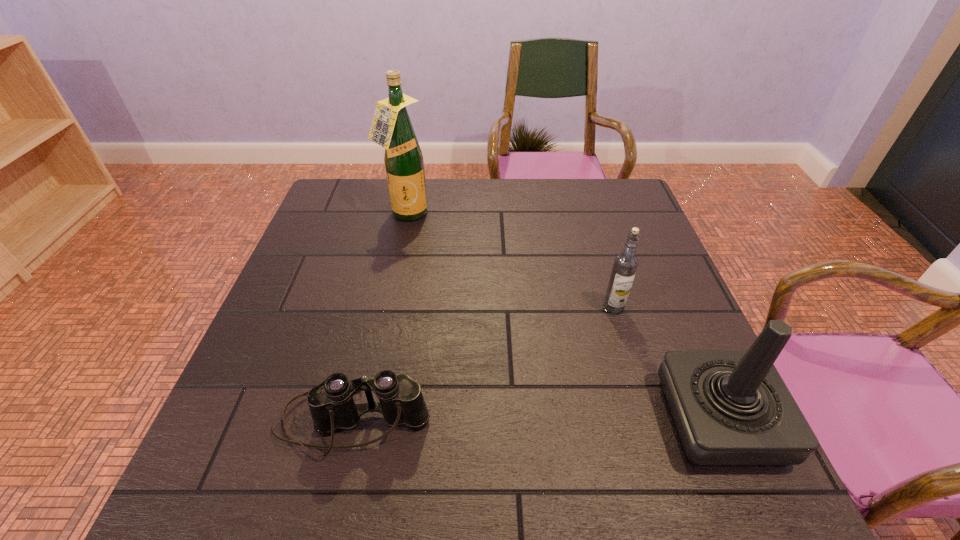
Image resolution: width=960 pixels, height=540 pixels. In order to click on vacant space located 0.340m on the label of the third nearest object in this screenshot , I will do `click(522, 413)`.

The width and height of the screenshot is (960, 540). I want to click on free space located on the label of the third nearest object, so click(593, 332).

This screenshot has height=540, width=960. What are the coordinates of `free space located 0.080m on the label of the third nearest object` in the screenshot? It's located at (590, 334).

The height and width of the screenshot is (540, 960). I want to click on object that is at the far edge, so click(391, 128).

Where is `binoculars situated at the near edge`? This screenshot has width=960, height=540. binoculars situated at the near edge is located at coordinates (331, 403).

Identify the location of joystick located in the near edge section of the desktop. (730, 408).

Find the location of a particular element. This screenshot has height=540, width=960. object present at the left edge is located at coordinates (331, 403).

You are a GUI agent. You are given a task and a screenshot of the screen. Output one action in this format:
    pyautogui.click(x=<x>, y=<y>)
    Task: Click on the joystick positioned at the right edge
    The width and height of the screenshot is (960, 540).
    Given the screenshot: What is the action you would take?
    pyautogui.click(x=730, y=408)

What are the coordinates of `vodka present at the right edge` in the screenshot? It's located at (625, 265).

The image size is (960, 540). Find the location of `object located at the near left corner`. object located at the near left corner is located at coordinates (331, 403).